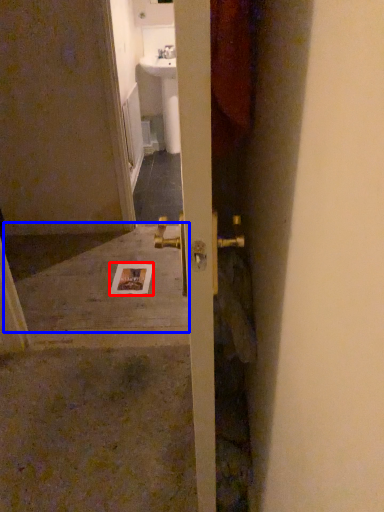
Question: Which of the following is the closest to the observer, postcard (highlighted by a red box) or concrete (highlighted by a blue box)?

Choices:
 (A) postcard
 (B) concrete

Answer: (B)